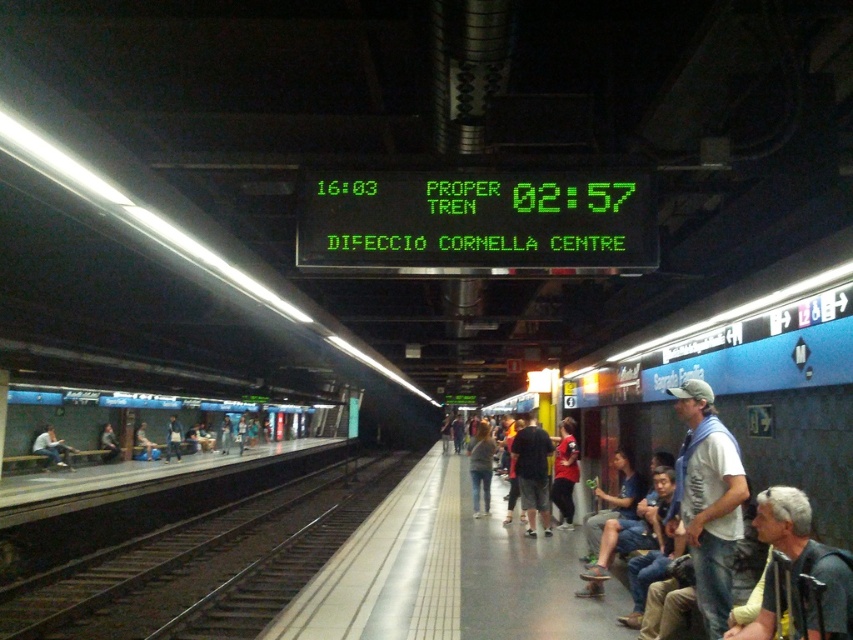
Question: Which of these objects is positioned closest to the blue glossy bench at left?

Choices:
 (A) black metal train track at lower left
 (B) light blue jeans at platform left

Answer: (B)

Question: Which point is closer to the camera?

Choices:
 (A) blue glossy bench at left
 (B) denim jeans at right
 (C) black metal train track at lower left
 (D) light blue jeans at platform left

Answer: (B)

Question: Estimate the real-world distances between objects in this image. Which object is closer to the black metal train track at lower left?

Choices:
 (A) blue glossy bench at left
 (B) light blue jeans at platform left

Answer: (B)

Question: Is the position of black metal train track at lower left more distant than that of blue glossy bench at left?

Choices:
 (A) yes
 (B) no

Answer: (B)

Question: Is the position of black metal train track at lower left more distant than that of light blue jeans at platform left?

Choices:
 (A) no
 (B) yes

Answer: (A)

Question: Is black metal train track at lower left above blue glossy bench at left?

Choices:
 (A) no
 (B) yes

Answer: (B)